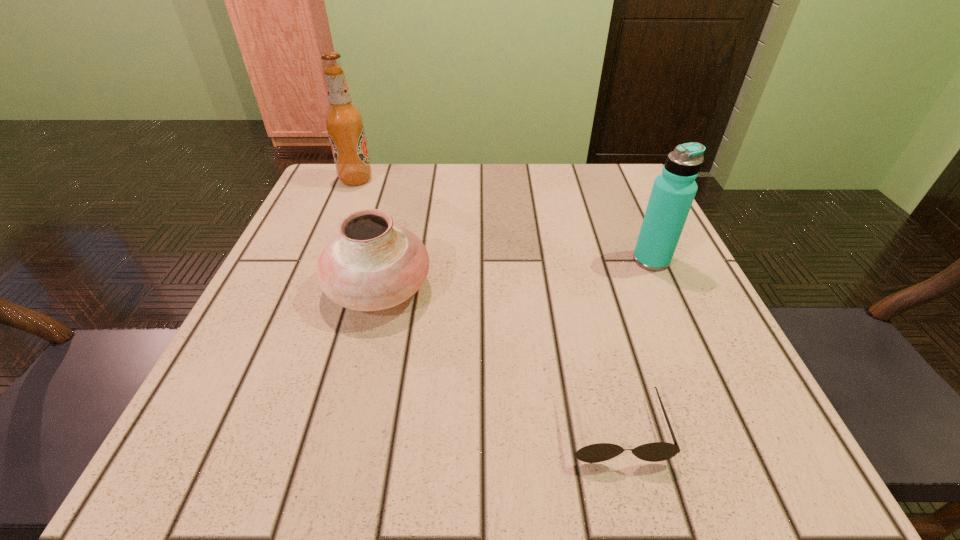
Locate an element on the screen. This screenshot has width=960, height=540. free spot between the nearest object and the second shortest object is located at coordinates (496, 359).

The height and width of the screenshot is (540, 960). Identify the location of unoccupied position between the nearest object and the pottery. (496, 359).

At what (x,y) coordinates should I click in order to perform the action: click on free spot between the second tallest object and the third tallest object. Please return your answer as a coordinate pair (x, y). The height and width of the screenshot is (540, 960). Looking at the image, I should click on (515, 274).

You are a GUI agent. You are given a task and a screenshot of the screen. Output one action in this format:
    pyautogui.click(x=<x>, y=<y>)
    Task: Click on the third closest object to the pottery
    The image size is (960, 540).
    Given the screenshot: What is the action you would take?
    pyautogui.click(x=673, y=192)

This screenshot has width=960, height=540. I want to click on object that is the closest to the third tallest object, so click(x=657, y=451).

You are a GUI agent. You are given a task and a screenshot of the screen. Output one action in this format:
    pyautogui.click(x=<x>, y=<y>)
    Task: Click on the free space that satisfies the following two spatial constraints: 1. on the front label of the beer bottle; 2. on the left side of the pottery
    Image resolution: width=960 pixels, height=540 pixels.
    Given the screenshot: What is the action you would take?
    pyautogui.click(x=311, y=289)

I want to click on free region that satisfies the following two spatial constraints: 1. on the front label of the tallest object; 2. on the back side of the water bottle, so click(324, 260).

Where is `vacant space that satisfies the following two spatial constraints: 1. on the front label of the tallest object; 2. on the left side of the rightmost object`? vacant space that satisfies the following two spatial constraints: 1. on the front label of the tallest object; 2. on the left side of the rightmost object is located at coordinates (324, 260).

Identify the location of vacant region that satisfies the following two spatial constraints: 1. on the front label of the farthest object; 2. on the left side of the second tallest object. The image size is (960, 540). (324, 260).